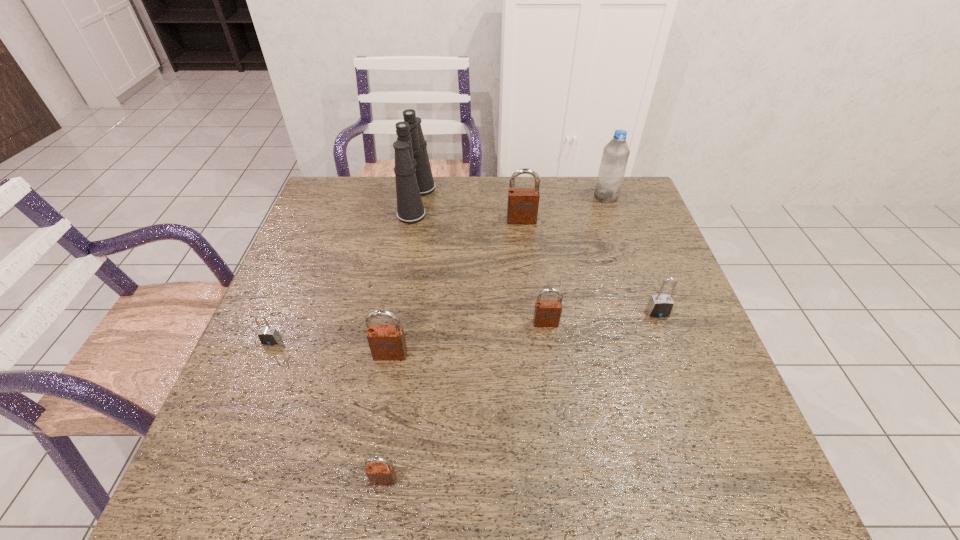
The height and width of the screenshot is (540, 960). What are the coordinates of `vacant region at the far edge of the desktop` in the screenshot? It's located at [x=570, y=215].

You are a GUI agent. You are given a task and a screenshot of the screen. Output one action in this format:
    pyautogui.click(x=<x>, y=<y>)
    Task: Click on the free space at the left edge of the desktop
    The image size is (960, 540).
    Given the screenshot: What is the action you would take?
    pyautogui.click(x=305, y=259)

Where is `vacant space at the right edge of the desktop`? vacant space at the right edge of the desktop is located at coordinates (646, 352).

Find the location of `vacant space at the far right corner of the desktop`. vacant space at the far right corner of the desktop is located at coordinates (631, 180).

The width and height of the screenshot is (960, 540). I want to click on vacant area that lies between the second farthest brown padlock and the biggest brown padlock, so click(534, 272).

This screenshot has width=960, height=540. I want to click on vacant space that is in between the second nearest brown padlock and the right gray padlock, so click(524, 334).

Where is `vacant area between the third nearest padlock and the second nearest object`? The image size is (960, 540). vacant area between the third nearest padlock and the second nearest object is located at coordinates (331, 348).

Identify the location of free space between the water bottle and the fourth farthest padlock. click(x=439, y=268).

In order to click on empty space that is in between the fifth farthest object and the second nearest object in this screenshot , I will do `click(468, 339)`.

Where is `free space between the blue water bottle and the third smallest brown padlock`? Image resolution: width=960 pixels, height=540 pixels. free space between the blue water bottle and the third smallest brown padlock is located at coordinates (498, 275).